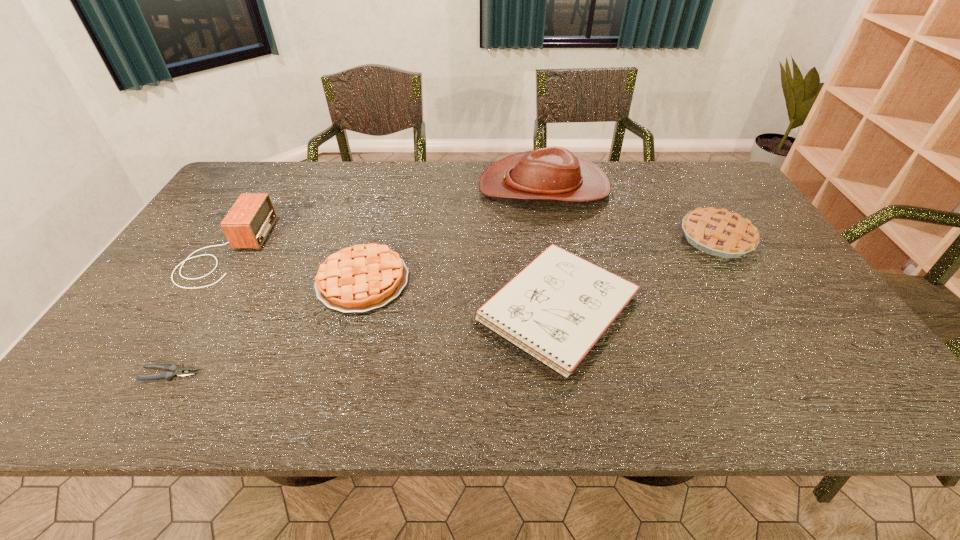
Identify the location of object that is at the right edge. (718, 232).

Locate an element on the screen. The width and height of the screenshot is (960, 540). object that is at the near left corner is located at coordinates (174, 371).

Find the location of a particular element. free point at the far edge is located at coordinates (681, 192).

The height and width of the screenshot is (540, 960). I want to click on free spot at the near edge of the desktop, so click(x=490, y=395).

Locate an element on the screen. The height and width of the screenshot is (540, 960). vacant space at the left edge of the desktop is located at coordinates (148, 324).

Locate an element on the screen. This screenshot has height=540, width=960. vacant area at the right edge is located at coordinates (780, 249).

The height and width of the screenshot is (540, 960). I want to click on blank space at the far right corner of the desktop, so click(x=676, y=166).

I want to click on unoccupied position between the tallest object and the left pie, so click(x=453, y=234).

Locate an element on the screen. Image resolution: width=960 pixels, height=540 pixels. free space between the farthest object and the radio receiver is located at coordinates (384, 219).

What are the coordinates of `unoccupied position between the notepad and the shortest object` in the screenshot? It's located at (364, 341).